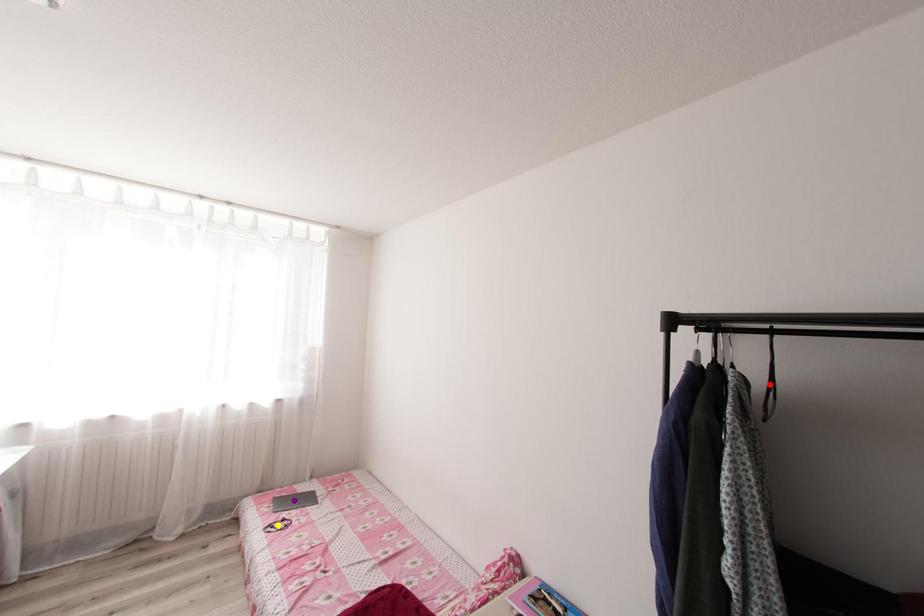
Order these from farthest to nearest:
1. red point
2. yellow point
3. purple point

1. purple point
2. yellow point
3. red point